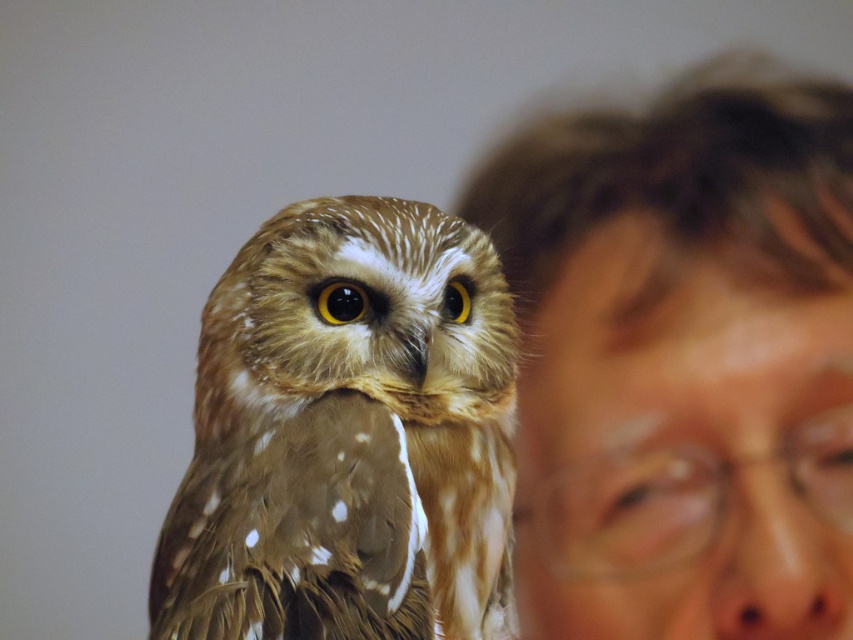
Is smooth skin face at right positioned before brown speckled feathers at center?

Yes, it is.

Does smooth skin face at right appear over brown speckled feathers at center?

Indeed, smooth skin face at right is positioned over brown speckled feathers at center.

Is point (831, 240) closer to viewer compared to point (398, 548)?

That is True.

This screenshot has height=640, width=853. I want to click on smooth skin face at right, so [x=682, y=358].